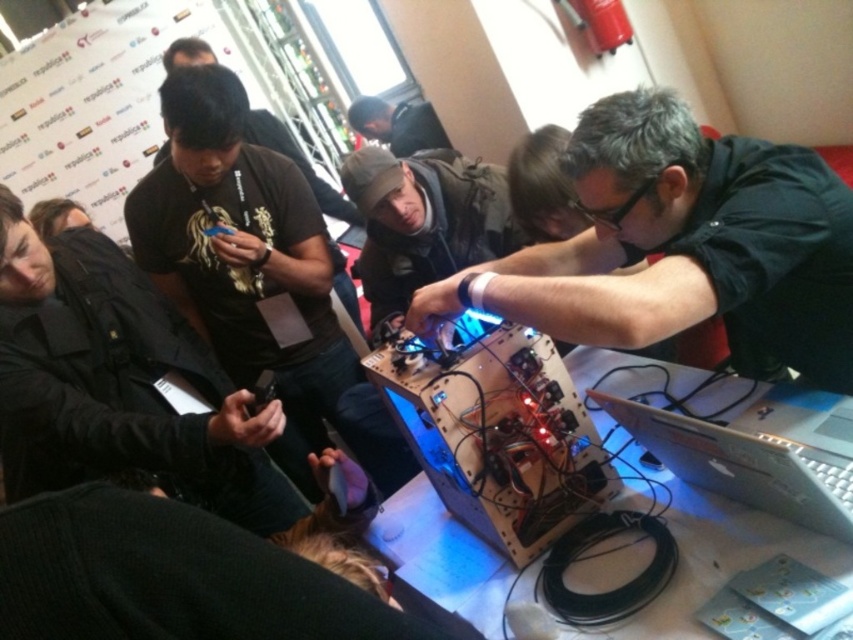
Does matte black shirt at center have a smaller size compared to black matte shirt at upper left?

Indeed, matte black shirt at center has a smaller size compared to black matte shirt at upper left.

The height and width of the screenshot is (640, 853). What do you see at coordinates (682, 246) in the screenshot?
I see `matte black shirt at center` at bounding box center [682, 246].

Find the location of a particular element. matte black shirt at center is located at coordinates (682, 246).

Does black matte shirt at upper left lie behind wooden circuit board at center?

That is True.

Is black matte shirt at upper left thinner than wooden circuit board at center?

No, black matte shirt at upper left is not thinner than wooden circuit board at center.

Who is more distant from viewer, (171, 324) or (492, 520)?

Positioned behind is point (171, 324).

Where is `black matte shirt at upper left`? This screenshot has height=640, width=853. black matte shirt at upper left is located at coordinates (119, 384).

Can you confirm if black matte t-shirt at center is bigger than dark gray fabric jacket at center?

Yes.

Who is shorter, black matte t-shirt at center or dark gray fabric jacket at center?

Standing shorter between the two is dark gray fabric jacket at center.

Measure the distance between black matte t-shirt at center and camera.

The distance of black matte t-shirt at center from camera is 5.68 feet.

This screenshot has height=640, width=853. Identify the location of black matte t-shirt at center. (242, 256).